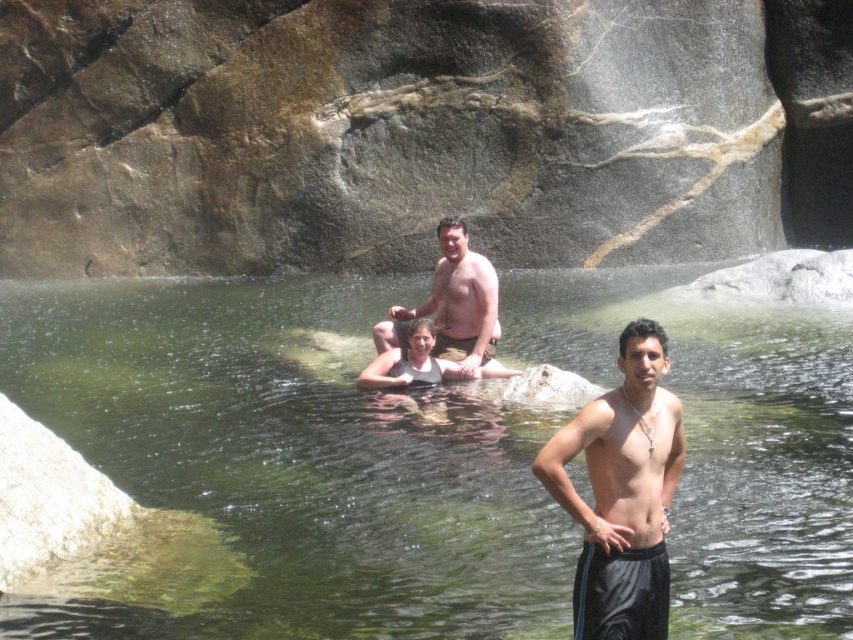
Is point (210, 368) less distant than point (665, 584)?

No, (210, 368) is further to viewer.

Does clear water at center have a greater height compared to shiny black shorts at center?

Correct, clear water at center is much taller as shiny black shorts at center.

Does point (750, 524) lie behind point (636, 394)?

Yes, it is behind point (636, 394).

You are a GUI agent. You are given a task and a screenshot of the screen. Output one action in this format:
    pyautogui.click(x=<x>, y=<y>)
    Task: Click on the clear water at center
    Image resolution: width=853 pixels, height=640 pixels.
    Given the screenshot: What is the action you would take?
    pyautogui.click(x=422, y=458)

Is shiny black shorts at center positioned before smooth tan skin at center?

Yes, it is.

Who is positioned more to the left, shiny black shorts at center or smooth tan skin at center?

smooth tan skin at center

Measure the distance between shiny black shorts at center and camera.

27.14 feet

Locate an element on the screen. The height and width of the screenshot is (640, 853). shiny black shorts at center is located at coordinates (622, 492).

Can you confirm if clear water at center is smaller than smooth tan skin at center?

No.

Is point (326, 368) more distant than point (389, 330)?

Yes, point (326, 368) is behind point (389, 330).

Does point (709, 340) come farther from viewer compared to point (440, 332)?

Yes, point (709, 340) is farther from viewer.

This screenshot has height=640, width=853. What are the coordinates of `clear water at center` in the screenshot? It's located at (422, 458).